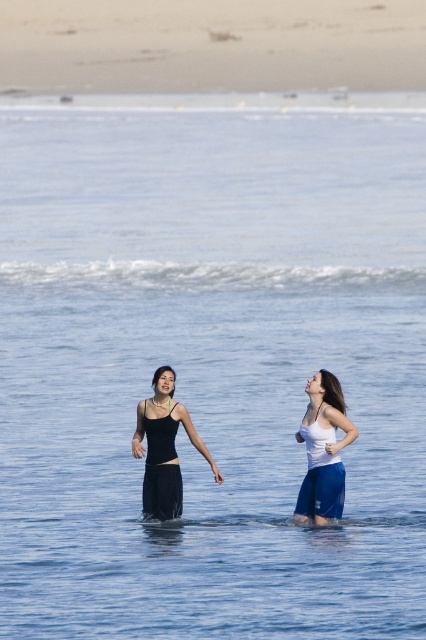
Consider the image. Is white matte tank top at center smaller than matte black dress at center?

Yes, white matte tank top at center is smaller than matte black dress at center.

In the scene shown: Is white matte tank top at center positioned in front of matte black dress at center?

That is True.

Who is more distant from viewer, (330,516) or (152,461)?

The point (152,461) is more distant.

This screenshot has height=640, width=426. Identify the location of white matte tank top at center. (324, 449).

Who is positioned more to the left, smooth sand at upper center or white matte tank top at center?

From the viewer's perspective, smooth sand at upper center appears more on the left side.

Who is more forward, (218, 0) or (298, 496)?

Positioned in front is point (298, 496).

Locate an element on the screen. The height and width of the screenshot is (640, 426). smooth sand at upper center is located at coordinates (210, 44).

Between smooth sand at upper center and black matte dress at center, which one has more height?

smooth sand at upper center

Is smooth sand at upper center bigger than black matte dress at center?

Yes, smooth sand at upper center is bigger than black matte dress at center.

This screenshot has width=426, height=640. Identify the location of smooth sand at upper center. (210, 44).

You are a GUI agent. You are given a task and a screenshot of the screen. Output one action in this format:
    pyautogui.click(x=<x>, y=<y>)
    Task: Click on the smooth sand at upper center
    The width and height of the screenshot is (426, 640).
    Given the screenshot: What is the action you would take?
    pyautogui.click(x=210, y=44)